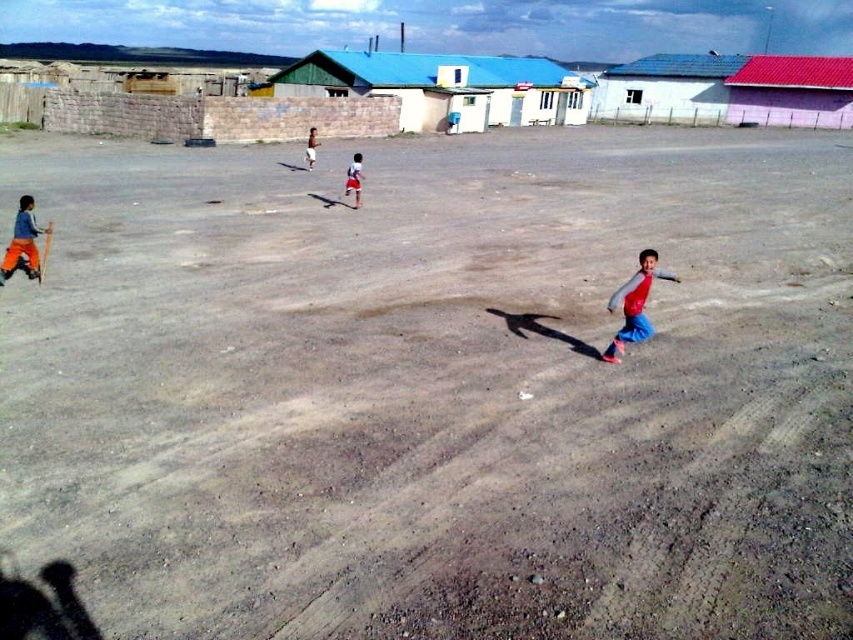
Is red cotton shirt at lower right below brushed orange pants at lower left?

Correct, red cotton shirt at lower right is located below brushed orange pants at lower left.

Between red cotton shirt at lower right and brushed orange pants at lower left, which one appears on the right side from the viewer's perspective?

red cotton shirt at lower right is more to the right.

Is point (607, 355) positioned behind point (33, 257)?

No, it is in front of (33, 257).

Where is `red cotton shirt at lower right`? This screenshot has height=640, width=853. red cotton shirt at lower right is located at coordinates (634, 305).

From the picture: Can you confirm if red cotton shirt at lower right is positioned to the right of red fabric shorts at center?

Indeed, red cotton shirt at lower right is positioned on the right side of red fabric shorts at center.

Between point (640, 333) and point (308, 164), which one is positioned in front?

Positioned in front is point (640, 333).

Find the location of `red cotton shirt at lower right`. red cotton shirt at lower right is located at coordinates (634, 305).

Locate an element on the screen. The height and width of the screenshot is (640, 853). red cotton shirt at lower right is located at coordinates point(634,305).

Can you confirm if red fabric shirt at center is bigger than red fabric shorts at center?

No.

Is red fabric shirt at center to the left of red fabric shorts at center from the viewer's perspective?

Incorrect, red fabric shirt at center is not on the left side of red fabric shorts at center.

This screenshot has width=853, height=640. Describe the element at coordinates (354, 179) in the screenshot. I see `red fabric shirt at center` at that location.

Identify the location of red fabric shirt at center. (354, 179).